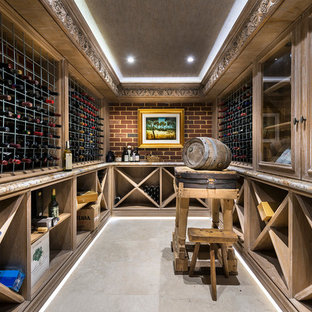
Where is `cupboard handle`? Image resolution: width=312 pixels, height=312 pixels. cupboard handle is located at coordinates (295, 121), (303, 120).